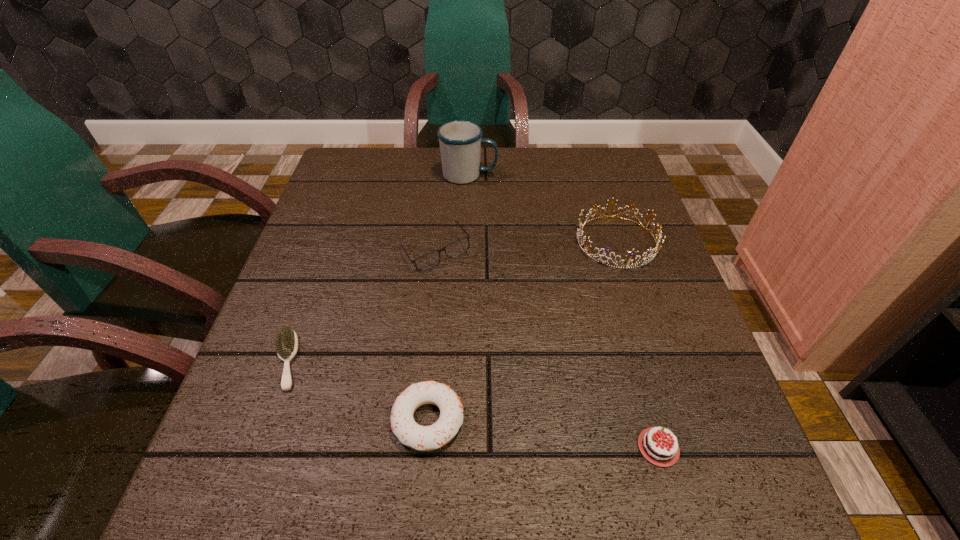
This screenshot has height=540, width=960. I want to click on blank space located 0.330m with the lenses facing outward on the spectacles, so click(x=419, y=417).

The width and height of the screenshot is (960, 540). In order to click on free location located 0.300m on the back of the doughnut in this screenshot , I will do `click(442, 265)`.

At what (x,y) coordinates should I click in order to perform the action: click on free space located 0.260m on the back of the chocolate cake. Please return your answer as a coordinate pair (x, y). The height and width of the screenshot is (540, 960). Looking at the image, I should click on (613, 288).

The width and height of the screenshot is (960, 540). I want to click on vacant space located on the back of the leftmost object, so click(329, 241).

In order to click on object located at the far edge in this screenshot , I will do `click(460, 141)`.

In order to click on object situated at the near edge in this screenshot , I will do `click(660, 452)`.

Locate an element on the screen. The image size is (960, 540). object present at the left edge is located at coordinates [286, 342].

Where is `tiara present at the right edge`? tiara present at the right edge is located at coordinates (651, 256).

The height and width of the screenshot is (540, 960). In order to click on chocolate cake that is at the right edge in this screenshot , I will do `click(660, 452)`.

Where is `object present at the near right corner`? This screenshot has height=540, width=960. object present at the near right corner is located at coordinates (660, 452).